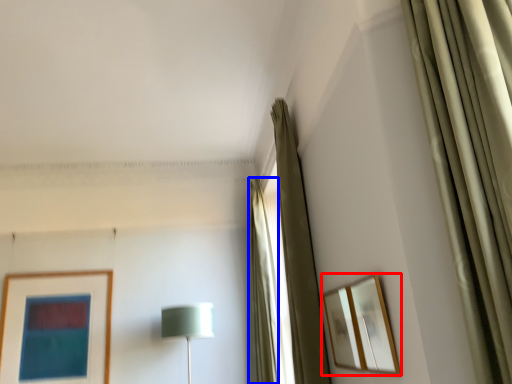
Question: Among these objects, which one is farthest to the camera, picture frame (highlighted by a red box) or curtain (highlighted by a blue box)?

Choices:
 (A) picture frame
 (B) curtain

Answer: (B)